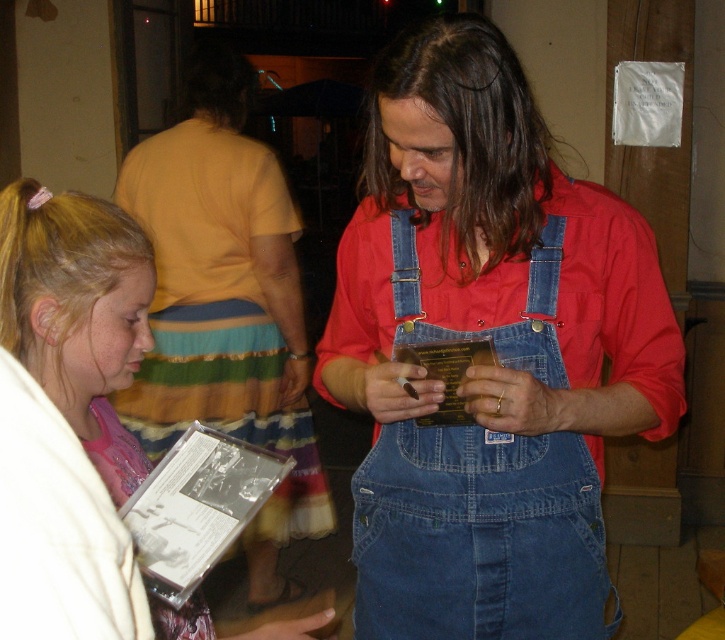
Based on the photo, between denim overalls at center and white matte cd at lower left, which one is positioned lower?

white matte cd at lower left

Who is more forward, (444, 88) or (8, 195)?

Point (8, 195) is more forward.

At what (x,y) coordinates should I click in order to perform the action: click on denim overalls at center. Please return your answer as a coordinate pair (x, y). This screenshot has width=725, height=640. Looking at the image, I should click on (494, 348).

Is white matte cd at lower left positioned before blonde hair at lower left?

Yes, it is in front of blonde hair at lower left.

Is point (138, 269) closer to camera compared to point (37, 282)?

No, (138, 269) is further to viewer.

Is point (117, 452) more distant than point (67, 260)?

Yes, it is.

Locate an element on the screen. white matte cd at lower left is located at coordinates (78, 314).

Is denim overalls at center positioned at the back of brown/dense hair at center?

No, it is not.

Is point (478, 547) less distant than point (523, 250)?

No, it is behind (523, 250).

Image resolution: width=725 pixels, height=640 pixels. I want to click on denim overalls at center, so click(494, 348).